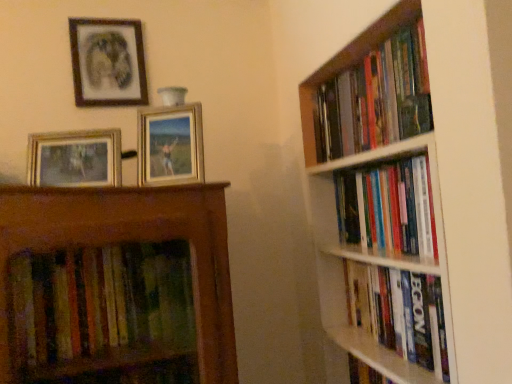
What do you see at coordinates (170, 145) in the screenshot? The image size is (512, 384). I see `metallic gold picture frame at upper center, marked as the 2th picture frame in a top-to-bottom arrangement` at bounding box center [170, 145].

What do you see at coordinates (108, 62) in the screenshot?
I see `matte black picture frame at upper left, the first picture frame viewed from the back` at bounding box center [108, 62].

Identify the location of white wooden bookshelf at right. This screenshot has width=512, height=384. (417, 192).

What do you see at coordinates (417, 192) in the screenshot?
I see `white wooden bookshelf at right` at bounding box center [417, 192].

What do you see at coordinates (389, 208) in the screenshot?
I see `hardcover books at right, marked as the 2th book in a top-to-bottom arrangement` at bounding box center [389, 208].

Identify the location of metallic gold picture frame at upper center, placed as the 2th picture frame when sorted from front to back. The height and width of the screenshot is (384, 512). coord(170,145).

In the scene shown: Considering the sizes of objects white wooden bookshelf at right and hardcover book at right, which ranks as the third book in top-to-bottom order, in the image provided, who is bigger, white wooden bookshelf at right or hardcover book at right, which ranks as the third book in top-to-bottom order,?

With larger size is white wooden bookshelf at right.

Is there a large distance between white wooden bookshelf at right and hardcover book at right, the first book positioned from the bottom?

white wooden bookshelf at right is near hardcover book at right, the first book positioned from the bottom, not far away.

From the image's perspective, is white wooden bookshelf at right below hardcover book at right, the first book positioned from the bottom?

No, from the image's perspective, white wooden bookshelf at right is not below hardcover book at right, the first book positioned from the bottom.

Relative to hardcover book at right, the first book positioned from the bottom, is white wooden bookshelf at right in front or behind?

In the image, white wooden bookshelf at right appears in front of hardcover book at right, the first book positioned from the bottom.

Is metallic gold picture frame at upper center, the second picture frame when ordered from back to front, to the right of hardcover books at right, arranged as the first book when viewed from the top, from the viewer's perspective?

Incorrect, metallic gold picture frame at upper center, the second picture frame when ordered from back to front, is not on the right side of hardcover books at right, arranged as the first book when viewed from the top.

How many degrees apart are the facing directions of metallic gold picture frame at upper center, the second picture frame when ordered from back to front, and hardcover books at right, the 3th book in the bottom-to-top sequence?

There is a 75.8-degree angle between the facing directions of metallic gold picture frame at upper center, the second picture frame when ordered from back to front, and hardcover books at right, the 3th book in the bottom-to-top sequence.

Is metallic gold picture frame at upper center, marked as the 2th picture frame in a top-to-bottom arrangement, completely or partially outside of hardcover books at right, the 3th book in the bottom-to-top sequence?

Absolutely, metallic gold picture frame at upper center, marked as the 2th picture frame in a top-to-bottom arrangement, is external to hardcover books at right, the 3th book in the bottom-to-top sequence.

Is point (163, 107) more distant than point (362, 69)?

No, (163, 107) is closer to viewer.

Considering the points (95, 130) and (438, 257), which point is behind, point (95, 130) or point (438, 257)?

The point (95, 130) is behind.

From a real-world perspective, is gold metallic picture frame at upper left, which ranks as the third picture frame in back-to-front order, physically below hardcover books at right, marked as the 2th book in a top-to-bottom arrangement?

No, from a real-world perspective, gold metallic picture frame at upper left, which ranks as the third picture frame in back-to-front order, is not under hardcover books at right, marked as the 2th book in a top-to-bottom arrangement.

Is gold metallic picture frame at upper left, which is the 1th picture frame from front to back, oriented away from hardcover books at right, marked as the 2th book in a top-to-bottom arrangement?

No, gold metallic picture frame at upper left, which is the 1th picture frame from front to back,'s orientation is not away from hardcover books at right, marked as the 2th book in a top-to-bottom arrangement.

Is matte black picture frame at upper left, which is counted as the first picture frame, starting from the top, looking in the opposite direction of hardcover books at right, arranged as the first book when viewed from the top?

matte black picture frame at upper left, which is counted as the first picture frame, starting from the top, is not turned away from hardcover books at right, arranged as the first book when viewed from the top.

Which picture frame is the 3rd one when counting from the back of the hardcover books at right, arranged as the first book when viewed from the top? Please provide its 2D coordinates.

[(108, 62)]

Could you measure the distance between matte black picture frame at upper left, the 3th picture frame viewed from the front, and hardcover books at right, the 3th book in the bottom-to-top sequence?

They are 26.80 inches apart.

From a real-world perspective, is matte black picture frame at upper left, which is counted as the first picture frame, starting from the top, over hardcover books at right, the 3th book in the bottom-to-top sequence?

Yes.

Considering the sizes of objects hardcover book at right, which ranks as the third book in top-to-bottom order, and white wooden bookshelf at right in the image provided, who is shorter, hardcover book at right, which ranks as the third book in top-to-bottom order, or white wooden bookshelf at right?

hardcover book at right, which ranks as the third book in top-to-bottom order.

Is hardcover book at right, which ranks as the third book in top-to-bottom order, to the right of white wooden bookshelf at right from the viewer's perspective?

Indeed, hardcover book at right, which ranks as the third book in top-to-bottom order, is positioned on the right side of white wooden bookshelf at right.

Is point (362, 294) positioned in front of point (324, 109)?

That is True.

Locate an element on the screen. The height and width of the screenshot is (384, 512). the 2nd picture frame counting from the left of the white wooden bookshelf at right is located at coordinates (75, 158).

Which object is closer to the camera taking this photo, white wooden bookshelf at right or gold metallic picture frame at upper left, marked as the 1th picture frame in a bottom-to-top arrangement?

white wooden bookshelf at right is more forward.

What's the angular difference between white wooden bookshelf at right and gold metallic picture frame at upper left, which is the 1th picture frame from front to back,'s facing directions?

The angular difference between white wooden bookshelf at right and gold metallic picture frame at upper left, which is the 1th picture frame from front to back, is 84.2 degrees.

Does white wooden bookshelf at right appear on the left side of gold metallic picture frame at upper left, which is the 1th picture frame from front to back?

Incorrect, white wooden bookshelf at right is not on the left side of gold metallic picture frame at upper left, which is the 1th picture frame from front to back.

From a real-world perspective, which object stands above the other?

matte black picture frame at upper left, the 3th picture frame viewed from the front, from a real-world perspective.

Which is closer to the camera, (82, 89) or (451, 139)?

The point (451, 139) is in front.

What's the angular difference between matte black picture frame at upper left, the 3th picture frame viewed from the front, and white wooden bookshelf at right's facing directions?

There is a 94.7-degree angle between the facing directions of matte black picture frame at upper left, the 3th picture frame viewed from the front, and white wooden bookshelf at right.

Locate an element on the screen. The image size is (512, 384). the 3rd book behind the white wooden bookshelf at right, counting from the anchor's position is located at coordinates (400, 313).

From a real-world perspective, count 1st picture frames downward from the hardcover books at right, arranged as the first book when viewed from the top, and point to it. Please provide its 2D coordinates.

[(170, 145)]

In the scene shown: Considering their positions, is matte black picture frame at upper left, which is counted as the first picture frame, starting from the top, positioned further to metallic gold picture frame at upper center, placed as the 2th picture frame when sorted from front to back, than hardcover book at right, which ranks as the third book in top-to-bottom order?

hardcover book at right, which ranks as the third book in top-to-bottom order.

Considering their positions, is white wooden bookshelf at right positioned closer to gold metallic picture frame at upper left, which is the 1th picture frame from front to back, than matte black picture frame at upper left, the first picture frame viewed from the back?

matte black picture frame at upper left, the first picture frame viewed from the back, is positioned closer to the anchor gold metallic picture frame at upper left, which is the 1th picture frame from front to back.

Estimate the real-world distances between objects in this image. Which object is further from hardcover book at right, the first book positioned from the bottom, matte black picture frame at upper left, the 3th picture frame viewed from the front, or metallic gold picture frame at upper center, which ranks as the 2th picture frame in bottom-to-top order?

matte black picture frame at upper left, the 3th picture frame viewed from the front.

Which object lies nearer to the anchor point hardcover book at right, the first book positioned from the bottom, white wooden bookshelf at right or gold metallic picture frame at upper left, which ranks as the third picture frame in back-to-front order?

white wooden bookshelf at right lies closer to hardcover book at right, the first book positioned from the bottom, than the other object.

Based on their spatial positions, is white wooden bookshelf at right or gold metallic picture frame at upper left, positioned as the 3th picture frame in top-to-bottom order, closer to hardcover books at right, placed as the 2th book when sorted from bottom to top?

The object closer to hardcover books at right, placed as the 2th book when sorted from bottom to top, is white wooden bookshelf at right.

When comparing their distances from matte black picture frame at upper left, which is counted as the first picture frame, starting from the top, does hardcover books at right, marked as the 2th book in a top-to-bottom arrangement, or white wooden bookshelf at right seem further?

hardcover books at right, marked as the 2th book in a top-to-bottom arrangement, is further to matte black picture frame at upper left, which is counted as the first picture frame, starting from the top.

Considering their positions, is hardcover books at right, the 3th book in the bottom-to-top sequence, positioned closer to metallic gold picture frame at upper center, marked as the 2th picture frame in a top-to-bottom arrangement, than matte black picture frame at upper left, the 3th picture frame positioned from the bottom?

matte black picture frame at upper left, the 3th picture frame positioned from the bottom.

When comparing their distances from hardcover books at right, arranged as the first book when viewed from the top, does hardcover books at right, marked as the 2th book in a top-to-bottom arrangement, or white wooden bookshelf at right seem closer?

Among the two, white wooden bookshelf at right is located nearer to hardcover books at right, arranged as the first book when viewed from the top.

Locate an element on the screen. picture frame between matte black picture frame at upper left, which is counted as the first picture frame, starting from the top, and gold metallic picture frame at upper left, positioned as the 3th picture frame in top-to-bottom order, in the up-down direction is located at coordinates (170, 145).

I want to click on picture frame situated between gold metallic picture frame at upper left, which ranks as the third picture frame in back-to-front order, and white wooden bookshelf at right from left to right, so click(x=170, y=145).

Locate an element on the screen. Image resolution: width=512 pixels, height=384 pixels. book between gold metallic picture frame at upper left, positioned as the 3th picture frame in top-to-bottom order, and hardcover books at right, placed as the 2th book when sorted from bottom to top is located at coordinates (372, 95).

Image resolution: width=512 pixels, height=384 pixels. I want to click on shelf between matte black picture frame at upper left, which is counted as the first picture frame, starting from the top, and hardcover books at right, marked as the 2th book in a top-to-bottom arrangement, in the horizontal direction, so click(x=417, y=192).